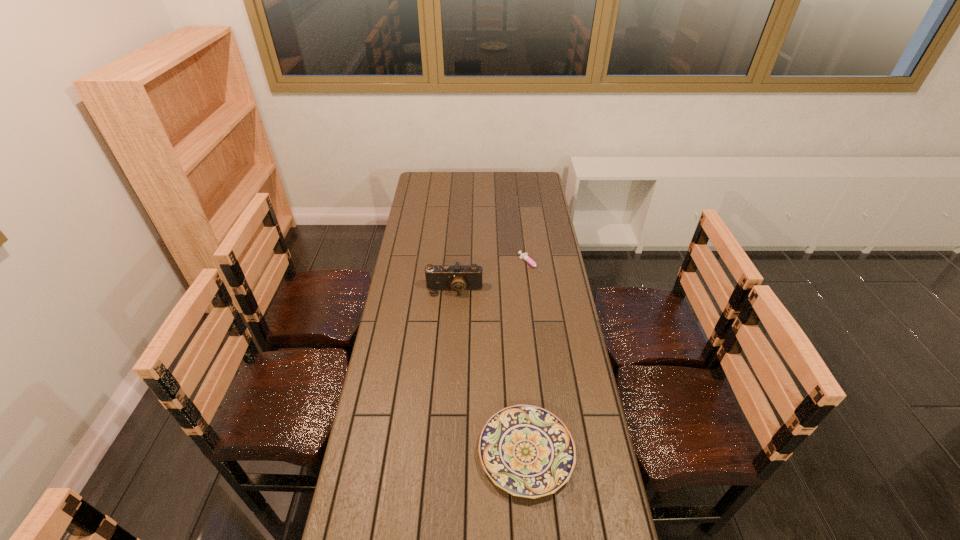
Locate an element on the screen. This screenshot has width=960, height=540. the tallest object is located at coordinates (458, 278).

Locate an element on the screen. the second farthest object is located at coordinates (458, 278).

This screenshot has width=960, height=540. What are the coordinates of `the nearest object` in the screenshot? It's located at (527, 451).

Find the location of a particular element. The width and height of the screenshot is (960, 540). the farthest object is located at coordinates (524, 256).

You are a GUI agent. You are given a task and a screenshot of the screen. Output one action in this format:
    pyautogui.click(x=<x>, y=<y>)
    Task: Click on the free space located on the front-facing side of the second farthest object
    Image resolution: width=960 pixels, height=540 pixels.
    Given the screenshot: What is the action you would take?
    pyautogui.click(x=448, y=379)

I want to click on free space located 0.150m on the back of the plate, so click(x=519, y=371).

At what (x,y) coordinates should I click in order to perform the action: click on free space located on the left of the syringe. Please return your answer as a coordinate pair (x, y). This screenshot has height=540, width=960. Looking at the image, I should click on (483, 265).

Where is `object located at the left edge`? The image size is (960, 540). object located at the left edge is located at coordinates (458, 278).

Where is `plate that is at the right edge`? plate that is at the right edge is located at coordinates pos(527,451).

Where is `syringe at the right edge`? The image size is (960, 540). syringe at the right edge is located at coordinates (524, 256).